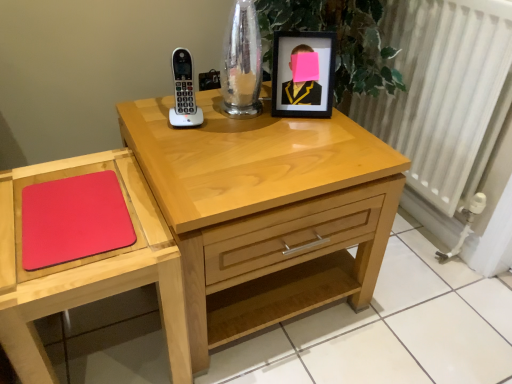
This screenshot has width=512, height=384. I want to click on vacant space to the right of light wood nightstand at center, so click(424, 312).